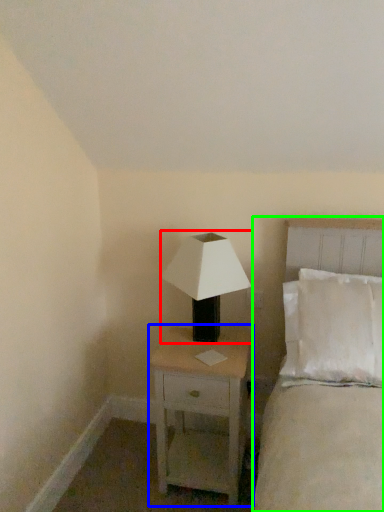
Question: Which object is positioned closest to lamp (highlighted by a red box)? Select from nightstand (highlighted by a blue box) and bed (highlighted by a green box).

Choices:
 (A) nightstand
 (B) bed

Answer: (A)